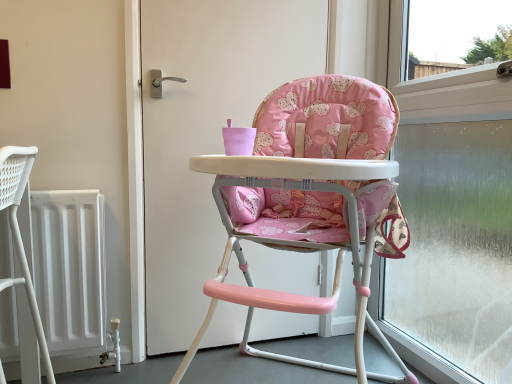
Question: Would you say frosted glass window at right is to the left or to the right of pink fabric high chair at center in the picture?

Choices:
 (A) right
 (B) left

Answer: (A)

Question: In terms of height, does frosted glass window at right look taller or shorter compared to pink fabric high chair at center?

Choices:
 (A) short
 (B) tall

Answer: (B)

Question: Estimate the real-world distances between objects in this image. Which object is closer to the pink fabric high chair at center?

Choices:
 (A) pink fabric highchair at center
 (B) frosted glass window at right

Answer: (A)

Question: Considering the real-world distances, which object is farthest from the frosted glass window at right?

Choices:
 (A) pink fabric highchair at center
 (B) pink fabric high chair at center

Answer: (B)